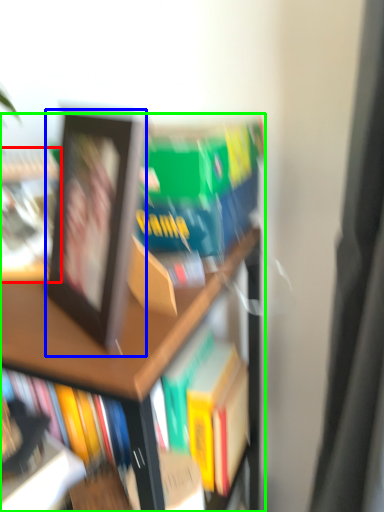
Question: Which object is the closest to the book (highlighted by a red box)? Choose among these: picture frame (highlighted by a blue box) or bookcase (highlighted by a green box).

Choices:
 (A) picture frame
 (B) bookcase

Answer: (A)